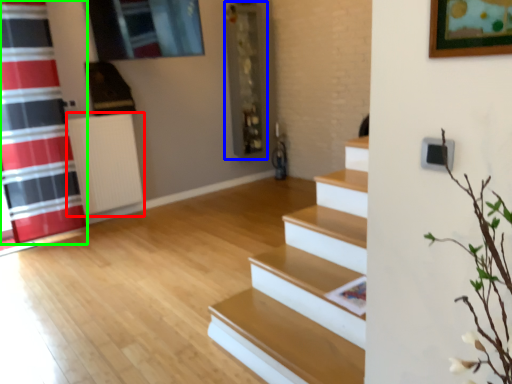
Question: Based on their relative distances, which object is nearer to radiator (highlighted by a red box)? Choose from shelf (highlighted by a blue box) and shower curtain (highlighted by a green box).

Choices:
 (A) shelf
 (B) shower curtain

Answer: (B)